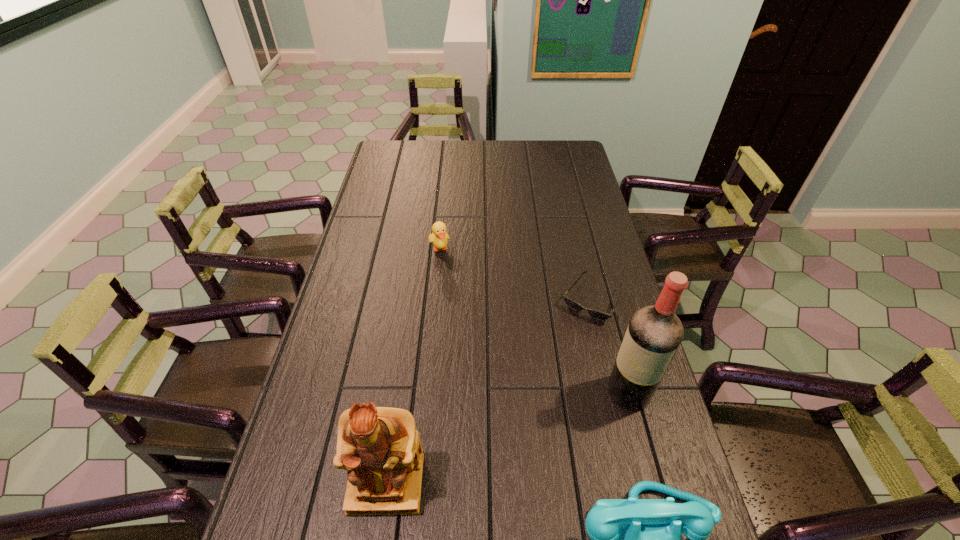
The image size is (960, 540). In order to click on free space at the left edge of the desktop in this screenshot , I will do `click(372, 215)`.

Locate an element on the screen. The height and width of the screenshot is (540, 960). vacant space at the right edge is located at coordinates (568, 168).

Where is `vacant region at the near left corner of the desktop`? vacant region at the near left corner of the desktop is located at coordinates (276, 510).

Identify the location of vacant region between the farthest object and the sunglasses. (516, 274).

Locate an element on the screen. This screenshot has width=960, height=540. empty location between the sunglasses and the liquor is located at coordinates (611, 346).

At what (x,y) coordinates should I click in order to perform the action: click on vacant area between the second shortest object and the figurine. Please return your answer as a coordinate pair (x, y). The height and width of the screenshot is (540, 960). Looking at the image, I should click on (413, 366).

The height and width of the screenshot is (540, 960). Find the location of `unoccupied area between the liquor and the second tallest object`. unoccupied area between the liquor and the second tallest object is located at coordinates (508, 437).

This screenshot has height=540, width=960. Find the location of `vacant point located between the shortest object and the fourth tallest object`. vacant point located between the shortest object and the fourth tallest object is located at coordinates (516, 274).

This screenshot has height=540, width=960. Identify the location of empty space between the sunglasses and the fourth shortest object. (489, 392).

Locate an element on the screen. The image size is (960, 540). object that can be found as the third closest to the liquor is located at coordinates (380, 447).